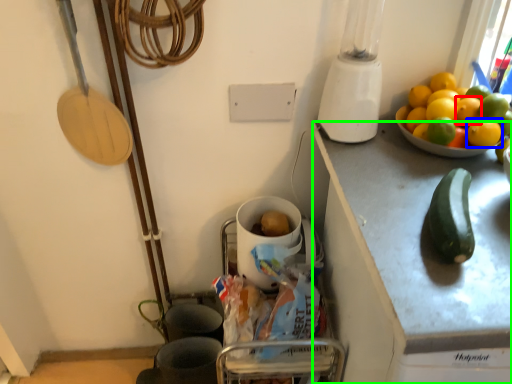
Question: Considering the real-world distances, which object is farthest from lemon (highlighted by a red box)? lemon (highlighted by a blue box) or cabinetry (highlighted by a green box)?

Choices:
 (A) lemon
 (B) cabinetry

Answer: (B)